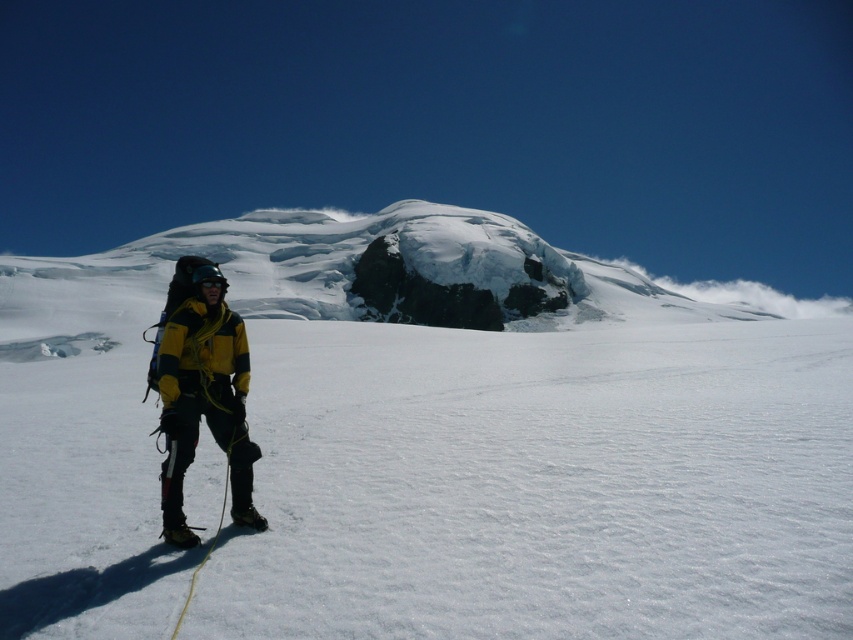
Question: Which point is closer to the camera?

Choices:
 (A) yellow fabric jacket at left
 (B) white powder snow at center

Answer: (B)

Question: Is white powder snow at center in front of yellow fabric jacket at left?

Choices:
 (A) no
 (B) yes

Answer: (B)

Question: Where is white powder snow at center located in relation to yellow fabric jacket at left in the image?

Choices:
 (A) left
 (B) right

Answer: (B)

Question: Is white powder snow at center to the right of yellow fabric jacket at left from the viewer's perspective?

Choices:
 (A) no
 (B) yes

Answer: (B)